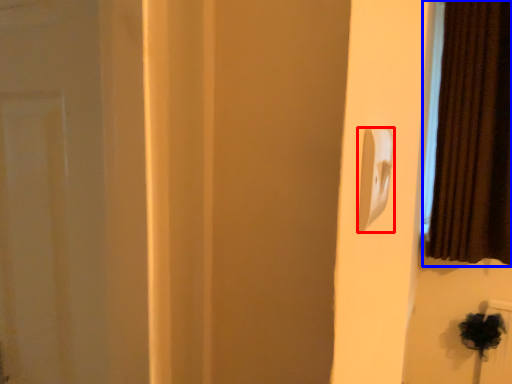
Question: Which object is further to the camera taking this photo, light switch (highlighted by a red box) or curtain (highlighted by a blue box)?

Choices:
 (A) light switch
 (B) curtain

Answer: (B)